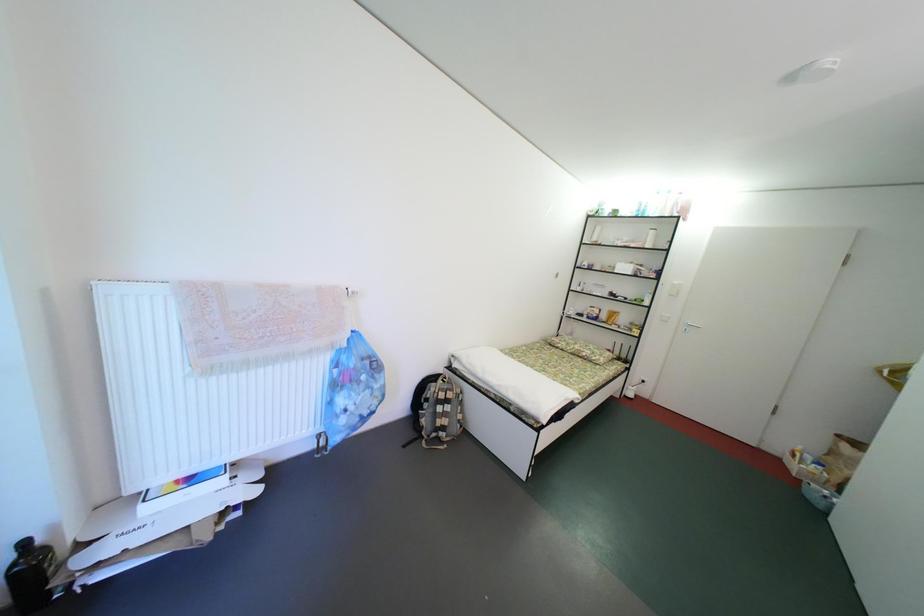
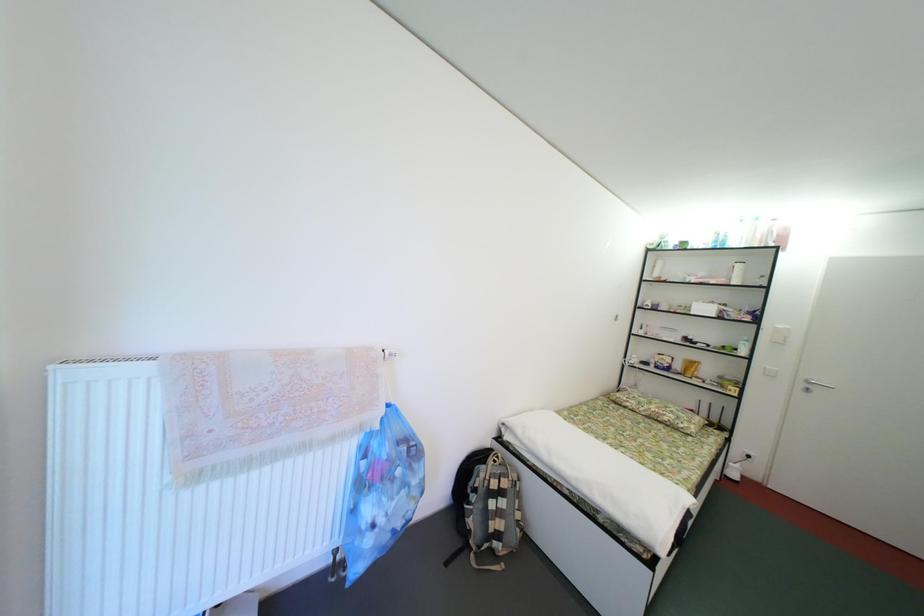
The images are taken continuously from a first-person perspective. In which direction are you moving?

The cameraman walked toward left, forward.